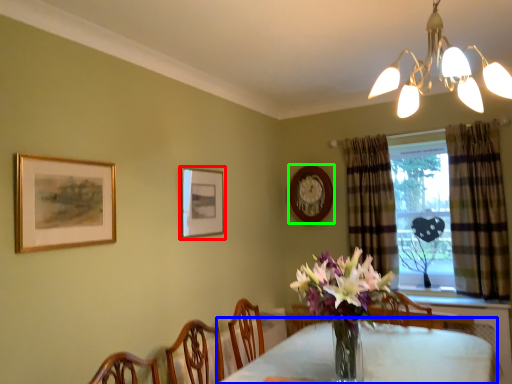
Question: Considering the real-world distances, which object is farthest from picture frame (highlighted by a red box)? table (highlighted by a blue box) or picture frame (highlighted by a green box)?

Choices:
 (A) table
 (B) picture frame

Answer: (A)